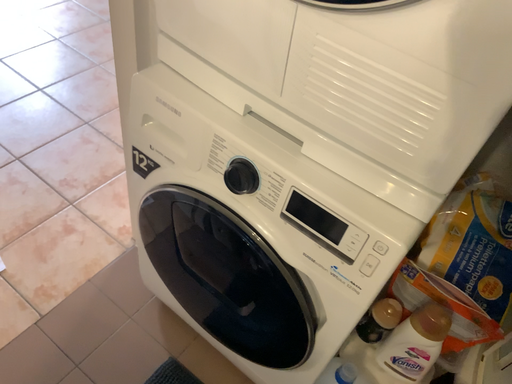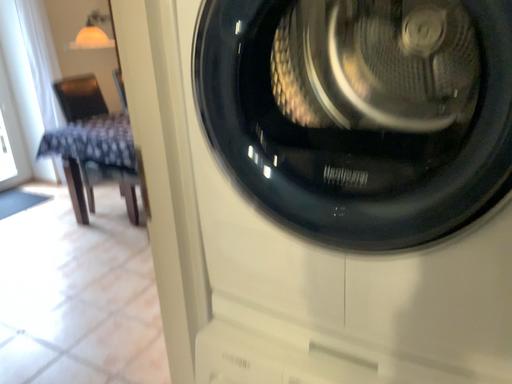
Question: Which way did the camera rotate in the video?

Choices:
 (A) rotated upward
 (B) rotated downward

Answer: (A)